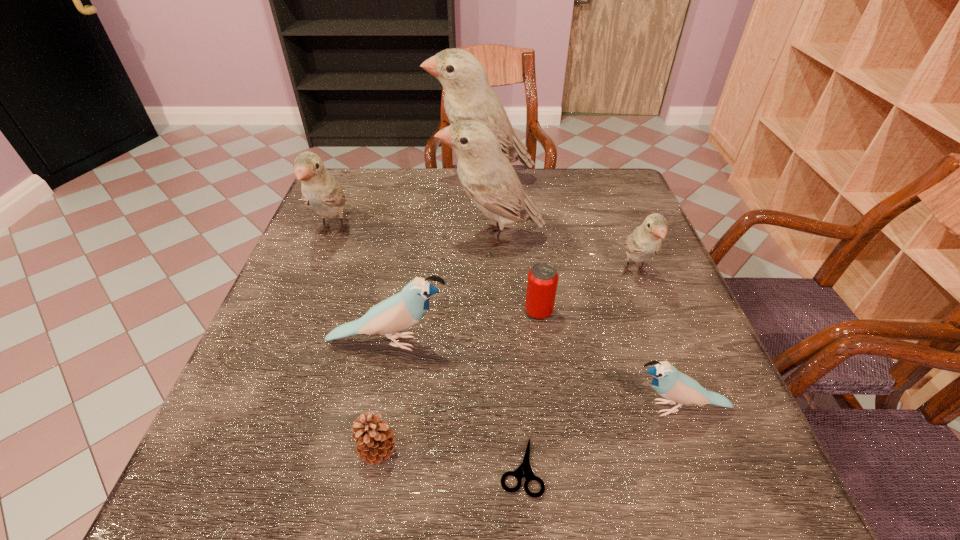
In order to click on unoccupied position between the smallest white bird and the eighth shortest object in this screenshot , I will do `click(564, 254)`.

Where is `free space between the rightmost white bird and the farthest bird`? free space between the rightmost white bird and the farthest bird is located at coordinates (558, 226).

You are a GUI agent. You are given a task and a screenshot of the screen. Output one action in this format:
    pyautogui.click(x=<x>, y=<y>)
    Task: Click on the vacant space that is in between the leftmost white bird and the right blue bird
    
    Given the screenshot: What is the action you would take?
    pyautogui.click(x=506, y=320)

Locate an element on the screen. Image resolution: width=960 pixels, height=540 pixels. free space between the third biggest white bird and the fifth farthest bird is located at coordinates (361, 287).

Identify the location of vacant space that is in between the farther blue bird and the farthest object. [435, 261].

Identify the location of free point between the second smallest white bird and the third shortest object. (436, 272).

Locate an element on the screen. free space between the fifth farthest bird and the nearest bird is located at coordinates (534, 375).

At what (x,y) coordinates should I click in order to perform the action: click on free space between the pinecone and the second biggest white bird. Please return your answer as a coordinate pair (x, y). The width and height of the screenshot is (960, 540). Looking at the image, I should click on tap(436, 343).

Locate an element on the screen. The height and width of the screenshot is (540, 960). vacant area between the second biggest white bird and the left blue bird is located at coordinates (440, 289).

Select which object is the fourth closest to the shears. Please provide its 2D coordinates. Your answer should be formatted as a tuple, i.e. [(x, y)], where the tuple contains the x and y coordinates of a point satisfying the conditions above.

[(542, 281)]